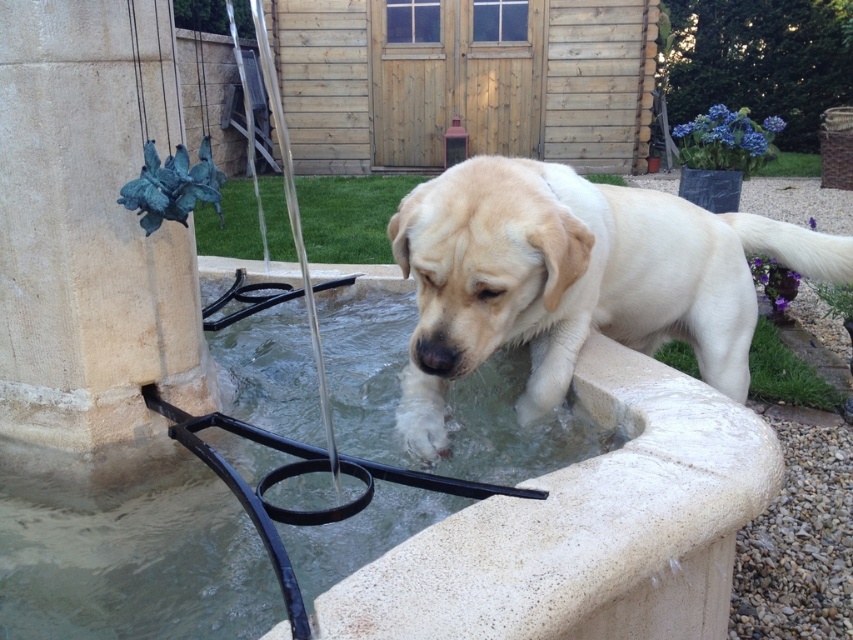
Question: Which point is farther from the camera taking this photo?

Choices:
 (A) (169, 356)
 (B) (422, 308)
 (C) (173, 536)

Answer: (A)

Question: Can you confirm if clear water at center is positioned above light beige fur at center?

Choices:
 (A) no
 (B) yes

Answer: (A)

Question: Is clear water at center to the right of light beige fur at center from the viewer's perspective?

Choices:
 (A) yes
 (B) no

Answer: (B)

Question: Among these points, which one is nearest to the camera?

Choices:
 (A) (155, 115)
 (B) (476, 340)
 (C) (398, 460)

Answer: (B)

Question: Observing the image, what is the correct spatial positioning of clear water at center in reference to green patina stone pillar at left?

Choices:
 (A) right
 (B) left

Answer: (A)

Question: Estimate the real-world distances between objects in this image. Which object is farther from the clear water at center?

Choices:
 (A) light beige fur at center
 (B) green patina stone pillar at left

Answer: (B)